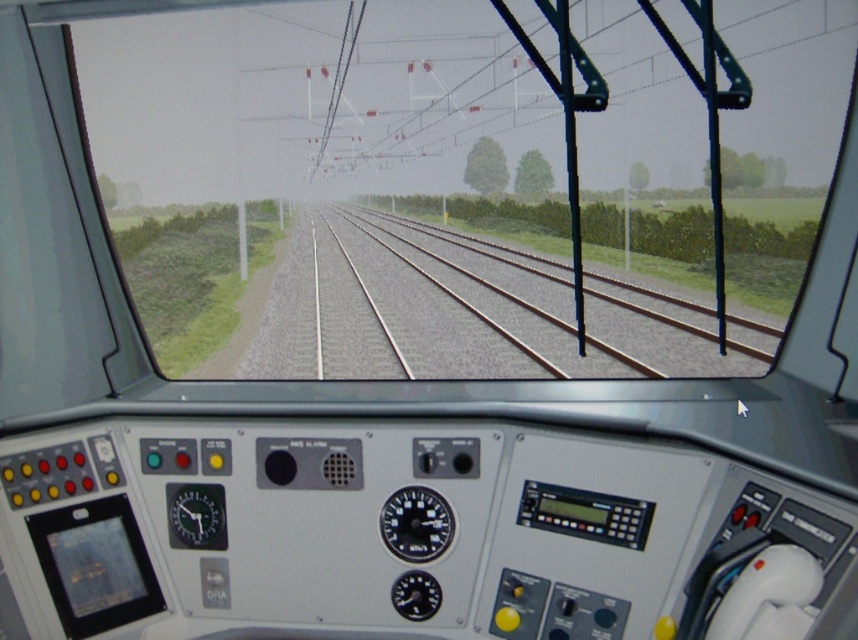
In the scene shown: Can you confirm if brown metal track at center is shorter than black plastic gauge at center?

Incorrect, brown metal track at center's height does not fall short of black plastic gauge at center's.

Does brown metal track at center appear over black plastic gauge at center?

Yes, brown metal track at center is above black plastic gauge at center.

Where is `brown metal track at center`? Image resolution: width=858 pixels, height=640 pixels. brown metal track at center is located at coordinates (518, 312).

Find the location of a particular element. brown metal track at center is located at coordinates (518, 312).

Is brown metal track at center wider than metallic gauge at center left?

Indeed, brown metal track at center has a greater width compared to metallic gauge at center left.

Between brown metal track at center and metallic gauge at center left, which one is positioned higher?

brown metal track at center is higher up.

Is point (680, 308) more distant than point (225, 532)?

Yes, it is.

In order to click on brown metal track at center in this screenshot , I will do `click(518, 312)`.

Who is positioned more to the right, black plastic gauge at center or metallic gauge at center left?

black plastic gauge at center is more to the right.

Between point (411, 525) and point (206, 522), which one is positioned behind?

The point (206, 522) is behind.

Locate an element on the screen. This screenshot has height=640, width=858. black plastic gauge at center is located at coordinates (415, 524).